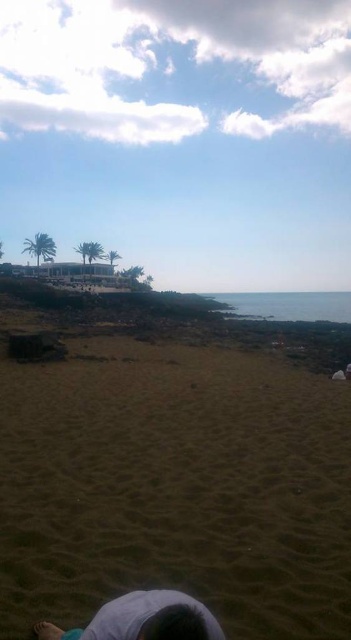
You are standing at the point marked as point (175, 484). What is the name of the object located exactly at your current position?

The object located exactly at point (175, 484) is the brown sandy beach at lower center.

You are standing at the edge of the sand in the coastal scene and want to walk to the rocky shoreline. There are two points marked on your map as point 1 at coordinates (226, 378) and point 2 at coordinates (111, 614). Which point should you head towards to reach the rocks more quickly?

Point 1 at coordinates (226, 378) is closer to you since it is further to the viewer than point 2 at coordinates (111, 614), so you should head towards point 1 to reach the rocks more quickly.

You are planning to set up a picnic on the brown sandy beach at lower center and the light blue fabric at lower center. Which area would you choose if you want more space for your picnic setup?

The brown sandy beach at lower center is bigger than the light blue fabric at lower center, so you should choose the brown sandy beach at lower center for more space.